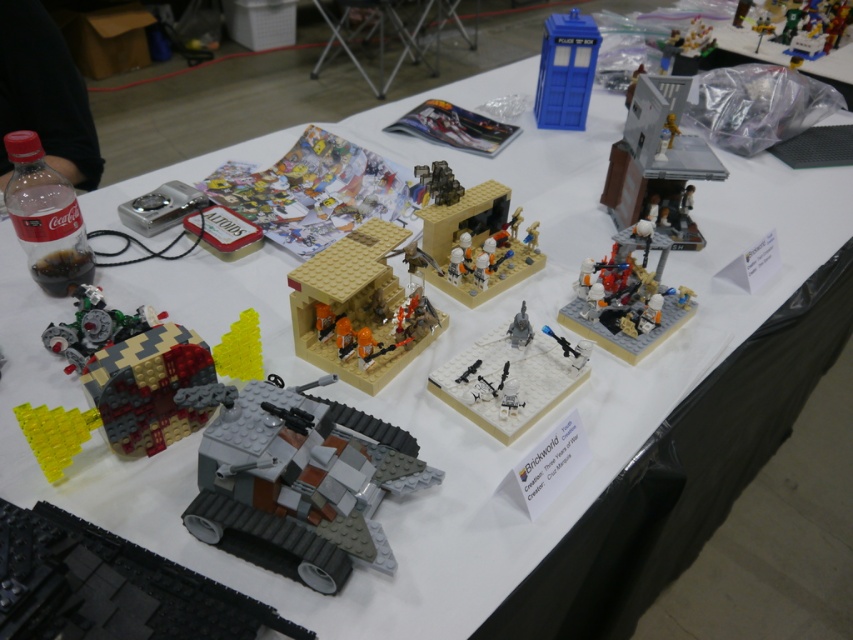
You are a LEGO enthusiast examining the display table. You notice the gray matte tank at lower left and the translucent plastic minifigures at upper right. Which object is larger in size?

The gray matte tank at lower left is smaller than the translucent plastic minifigures at upper right, so the translucent plastic minifigures at upper right are larger.

You are standing at the center of the table and want to place a new LEGO set near the tan matte building at center. According to the coordinates provided, where should you place the new LEGO set?

The tan matte building at center is located at coordinates point [358,305], so place the new LEGO set near those coordinates.